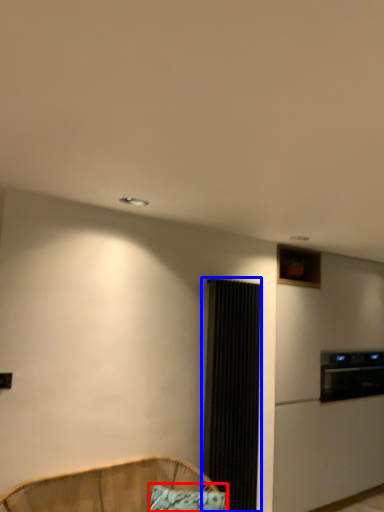
Question: Which object is further to the camera taking this photo, pillow (highlighted by a red box) or screen door (highlighted by a blue box)?

Choices:
 (A) pillow
 (B) screen door

Answer: (B)